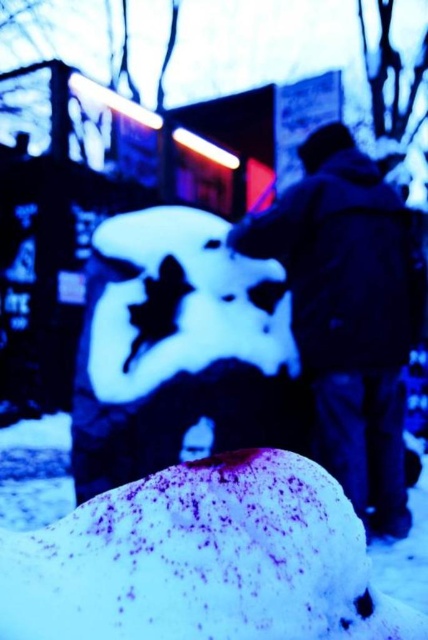
Question: Which object is closer to the camera taking this photo?

Choices:
 (A) white fluffy snow at center
 (B) white matte snowman at center
 (C) dark blue jacket at center

Answer: (A)

Question: Is white fluffy snow at center wider than white matte snowman at center?

Choices:
 (A) yes
 (B) no

Answer: (B)

Question: Is white fluffy snow at center wider than white matte snowman at center?

Choices:
 (A) yes
 (B) no

Answer: (B)

Question: Does white matte snowman at center appear over dark blue jacket at center?

Choices:
 (A) yes
 (B) no

Answer: (B)

Question: Estimate the real-world distances between objects in this image. Which object is closer to the white matte snowman at center?

Choices:
 (A) dark blue jacket at center
 (B) white fluffy snow at center

Answer: (A)

Question: Which object is closer to the camera taking this photo?

Choices:
 (A) dark blue jacket at center
 (B) white matte snowman at center
 (C) white fluffy snow at center

Answer: (C)